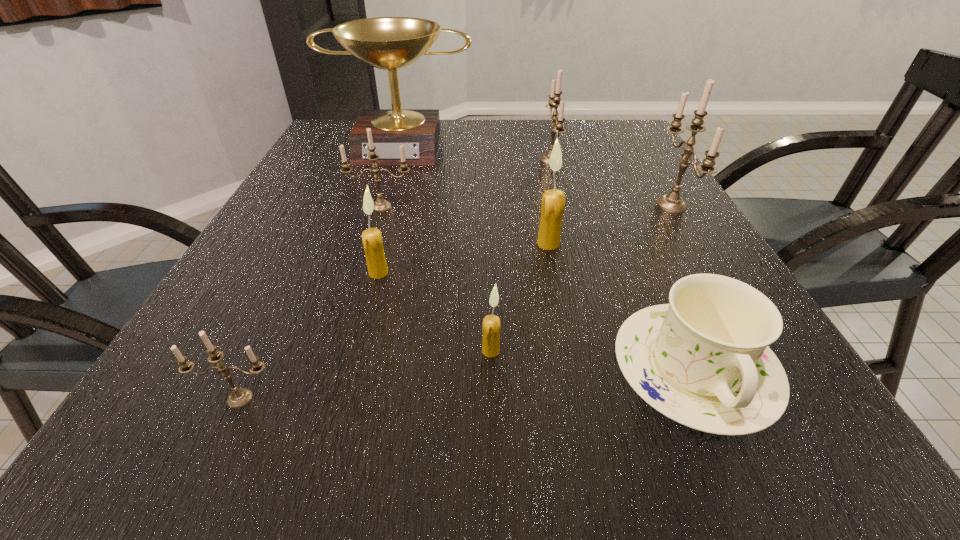
You are a GUI agent. You are given a task and a screenshot of the screen. Output one action in this format:
    pyautogui.click(x=<x>, y=<y>)
    Task: Click on the chinaware at the right edge
    
    Given the screenshot: What is the action you would take?
    pyautogui.click(x=703, y=360)

At what (x,y) coordinates should I click in order to perform the action: click on object that is at the far left corner. Please return your answer as a coordinate pair (x, y). Looking at the image, I should click on (390, 43).

What are the coordinates of `object that is at the near left corner` in the screenshot? It's located at (239, 397).

I want to click on object located at the near right corner, so click(703, 360).

At what (x,y) coordinates should I click in order to perform the action: click on blank area at the far edge. Please return your answer as a coordinate pair (x, y). Image resolution: width=960 pixels, height=540 pixels. Looking at the image, I should click on (466, 137).

In the image, there is a desktop. Identify the location of vacant space at the left edge. The width and height of the screenshot is (960, 540). (287, 240).

Where is `free region at the right edge`? free region at the right edge is located at coordinates (616, 182).

Locate an element on the screen. This screenshot has height=540, width=960. vacant space at the near right corner is located at coordinates (745, 438).

Find the location of a particular element. The image size is (960, 540). free space that is in between the second metallic candle from right to left and the fourth candle from left to right is located at coordinates (520, 255).

Identify the location of free space between the rightmost cream candle and the second nearest candle. The height and width of the screenshot is (540, 960). (519, 297).